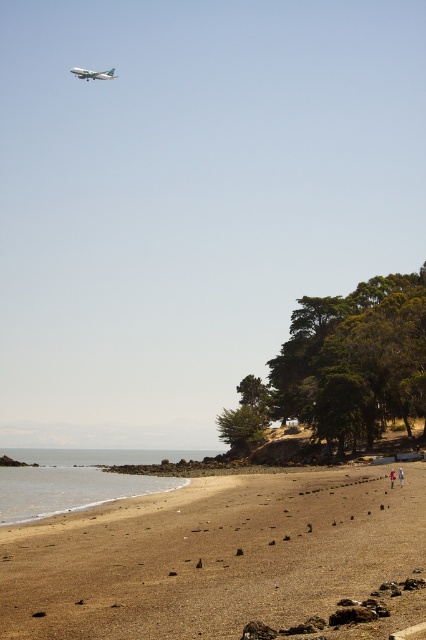
You are a photographer trying to capture the entire scene of the brown sandy beach at lower center and the white fabric person at lower right in one shot. Based on their heights, which object should you position closer to the camera to ensure both are fully visible?

The brown sandy beach at lower center has a greater height compared to the white fabric person at lower right. To ensure both are fully visible in the photo, position the white fabric person at lower right closer to the camera so that their smaller height can be captured without cropping, while the taller brown sandy beach at lower center can be framed appropriately in the background.

You are a photographer planning to take a wide shot of the brown sandy beach at lower center and the white fabric person at lower right. Based on their sizes, which one should you focus on to ensure they both fit in the frame without cropping?

The brown sandy beach at lower center is wider than the white fabric person at lower right, so focusing on the brown sandy beach at lower center will ensure both fit in the frame without cropping.

You are a pilot flying a silver metallic airplane at upper left. You need to land at the airport located 400 meters away from your current position. Can you safely land at the airport?

The silver metallic airplane at upper left is 419.32 meters away from the viewer, so it cannot safely land at the airport located 400 meters away since it is farther than the required distance.